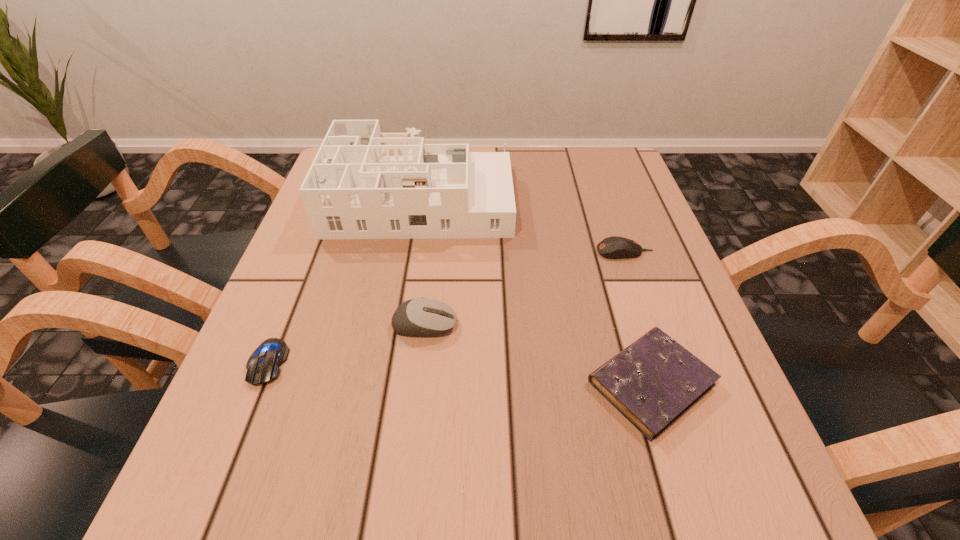
Where is `the tallest object`? This screenshot has width=960, height=540. the tallest object is located at coordinates (363, 184).

This screenshot has height=540, width=960. In order to click on dollhouse in this screenshot , I will do `click(363, 184)`.

Locate an element on the screen. This screenshot has height=540, width=960. the tallest computer mouse is located at coordinates (416, 317).

The image size is (960, 540). I want to click on the second computer mouse from right to left, so click(416, 317).

Locate an element on the screen. the farthest computer mouse is located at coordinates (614, 247).

Identify the location of the third tallest object. The height and width of the screenshot is (540, 960). (614, 247).

The image size is (960, 540). What are the coordinates of `the shortest computer mouse` in the screenshot? It's located at (263, 365).

Locate an element on the screen. This screenshot has height=540, width=960. diary is located at coordinates (652, 382).

Identify the location of vacant space located 0.090m on the right of the farthest object. pyautogui.click(x=548, y=197).

This screenshot has height=540, width=960. I want to click on vacant point located 0.070m on the wheel side of the second tallest object, so click(495, 325).